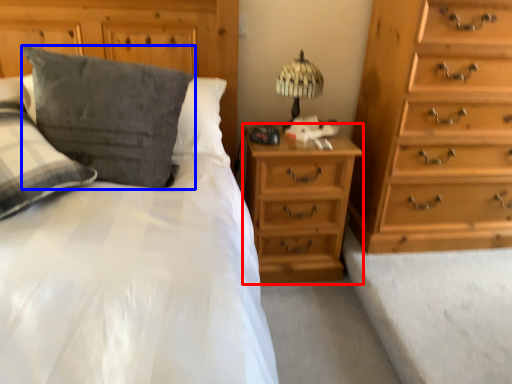
Question: Which point is further to the camera, nightstand (highlighted by a red box) or pillow (highlighted by a blue box)?

Choices:
 (A) nightstand
 (B) pillow

Answer: (A)